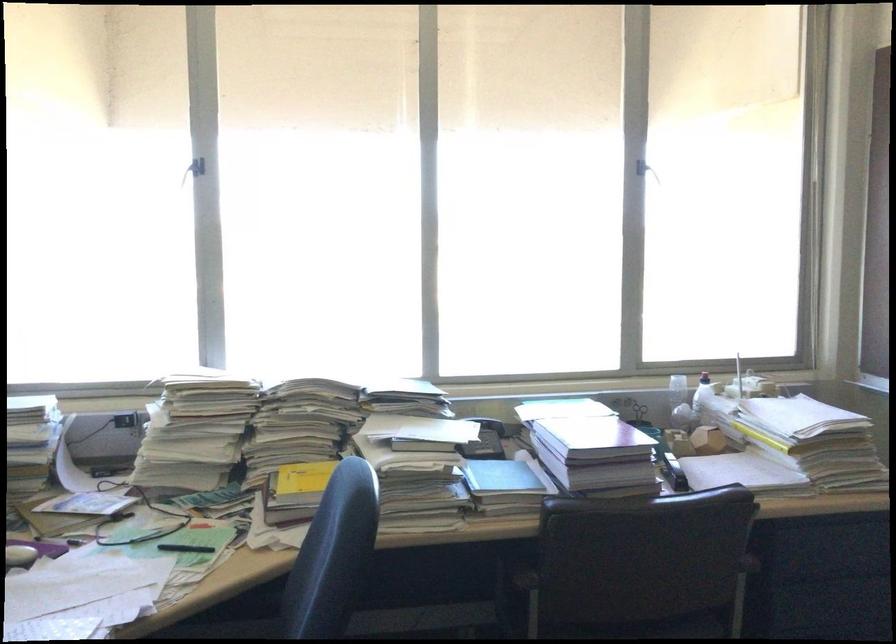
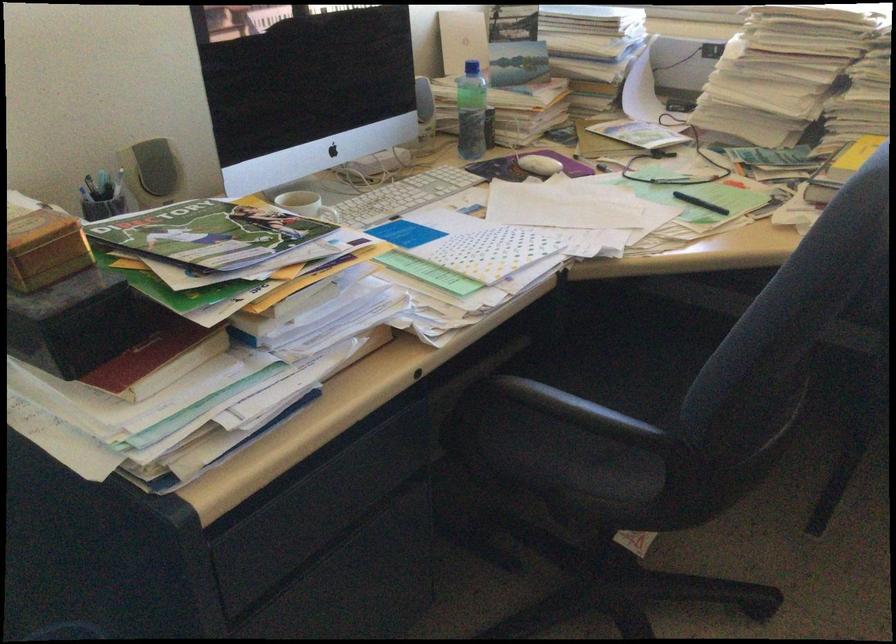
Find the pixel in the second image that matches pixel 186 554 in the first image.

(700, 203)